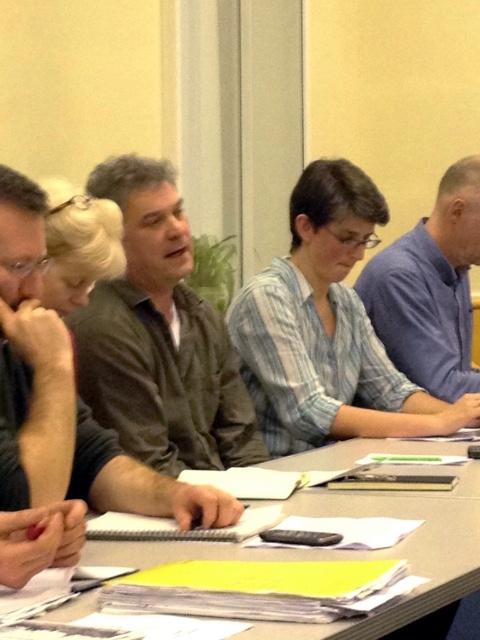
You are sitting at the smooth gray table at center and want to pass a note to the person wearing the dark brown shirt at center. In which direction should you pass the note?

The dark brown shirt at center is to the left of the smooth gray table at center, so you should pass the note to your left.

You are standing in the meeting room and need to place a new laptop on the smooth gray table at center. Given that the table is at coordinates 0.863 on the x and 0.738 on the y, can you confirm the exact location to place the laptop?

The smooth gray table at center is located at coordinates 0.863 on the x and 0.738 on the y, so you can place the laptop there.

You are a photographer trying to capture a group photo of the dark brown shirt at center and the blue shirt at right. Since you want to ensure both are visible in the frame, which person should you position closer to the camera?

The dark brown shirt at center has a lesser height compared to blue shirt at right, so you should position the dark brown shirt at center closer to the camera to ensure both are visible in the frame.